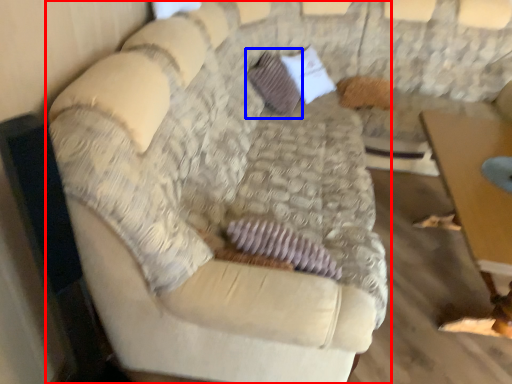
Question: Which object is closer to the camera taking this photo, studio couch (highlighted by a red box) or pillow (highlighted by a blue box)?

Choices:
 (A) studio couch
 (B) pillow

Answer: (A)